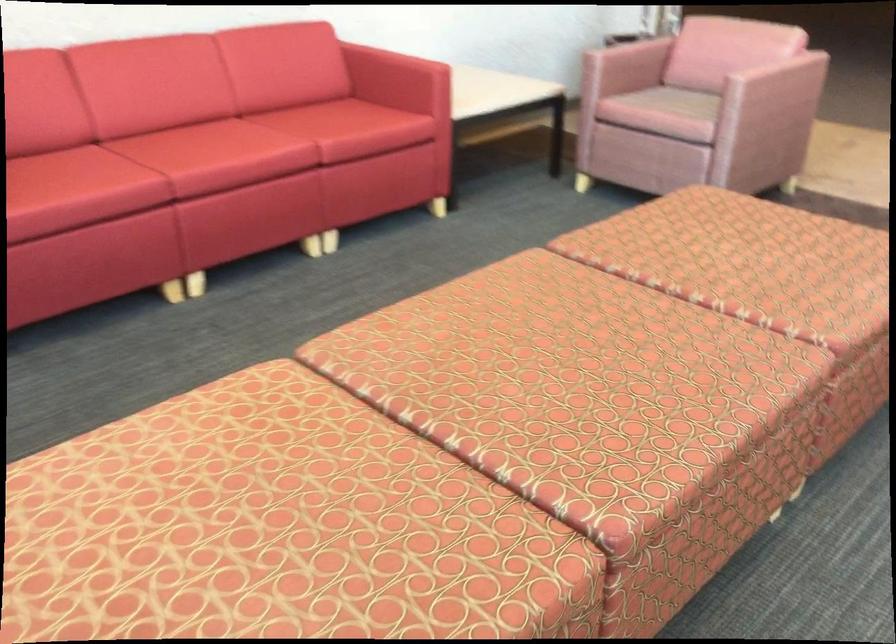
Find where to sit the sofa sitting surface. Please return your answer as a coordinate pair (x, y).

(196, 144)